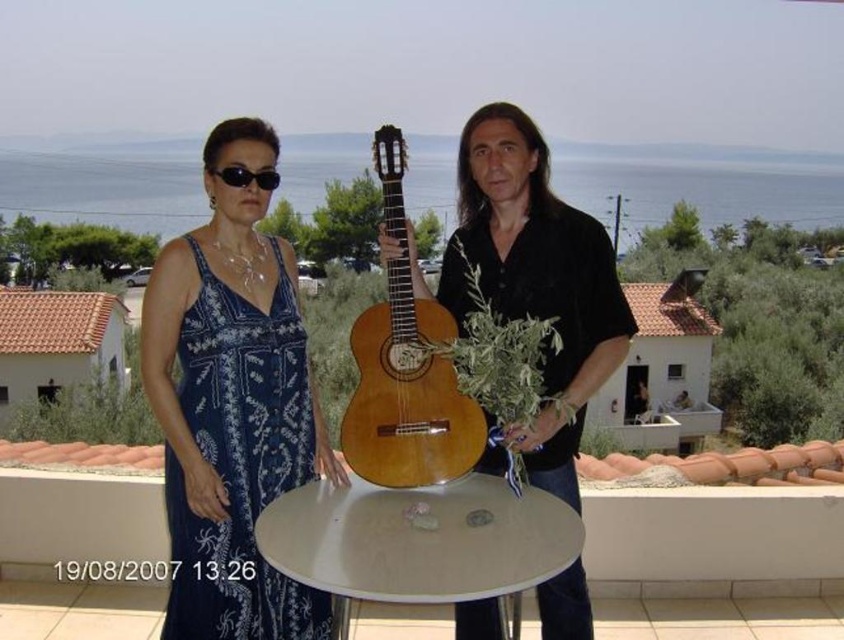
You are a photographer trying to capture the scene from the perspective of someone standing in front of the two people. Which object, the blue printed fabric dress at left or the black plastic sunglasses at upper center, would appear closer to you?

The blue printed fabric dress at left is to the left of black plastic sunglasses at upper center, so from the photographer perspective, the blue printed fabric dress at left would appear closer since it is positioned to the left side.

You are planning to place a rectangular music stand that is 1 meter wide on the white glossy round table at center. Considering the table and guitar, will the music stand fit on the table without overlapping the natural wood guitar at center?

The white glossy round table at center has a width less than the natural wood guitar at center, so the music stand that is 1 meter wide would not fit on the table without overlapping the guitar.

You are a photographer trying to capture both the white glossy round table at center and the natural wood guitar at center in a single shot. Since the camera can only focus on one object at a time, which object should you focus on to ensure the other remains in the background?

You should focus on the white glossy round table at center because it is in front of the natural wood guitar at center, so the guitar will naturally be in the background.